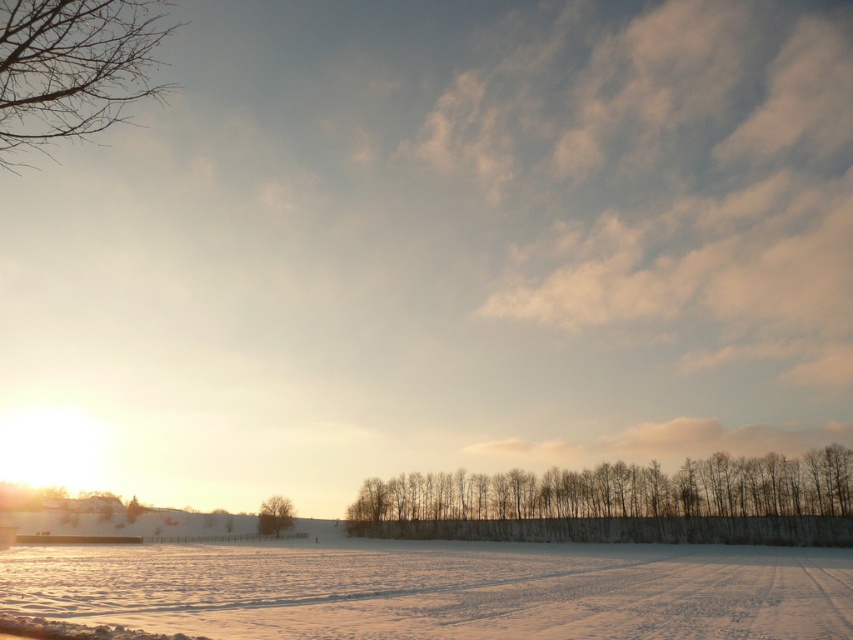
Can you confirm if white powdery snow at lower center is wider than green matte tree at center?

Yes, white powdery snow at lower center is wider than green matte tree at center.

Is white powdery snow at lower center thinner than green matte tree at center?

No, white powdery snow at lower center is not thinner than green matte tree at center.

Who is more forward, [247,554] or [273,522]?

Point [247,554]

You are a GUI agent. You are given a task and a screenshot of the screen. Output one action in this format:
    pyautogui.click(x=<x>, y=<y>)
    Task: Click on the white powdery snow at lower center
    Image resolution: width=853 pixels, height=640 pixels.
    Given the screenshot: What is the action you would take?
    pyautogui.click(x=437, y=589)

Is snowy bare trees at lower center to the left of green matte tree at center from the viewer's perspective?

No, snowy bare trees at lower center is not to the left of green matte tree at center.

Does snowy bare trees at lower center have a greater width compared to green matte tree at center?

Yes.

The width and height of the screenshot is (853, 640). Describe the element at coordinates (624, 502) in the screenshot. I see `snowy bare trees at lower center` at that location.

I want to click on snowy bare trees at lower center, so click(624, 502).

Is point (59, 38) positioned before point (260, 516)?

That is True.

From the picture: Does bare branches at upper left have a larger size compared to green matte tree at center?

Indeed, bare branches at upper left has a larger size compared to green matte tree at center.

At what (x,y) coordinates should I click in order to perform the action: click on bare branches at upper left. Please return your answer as a coordinate pair (x, y). This screenshot has height=640, width=853. Looking at the image, I should click on (73, 67).

Where is `bare branches at upper left`? bare branches at upper left is located at coordinates (73, 67).